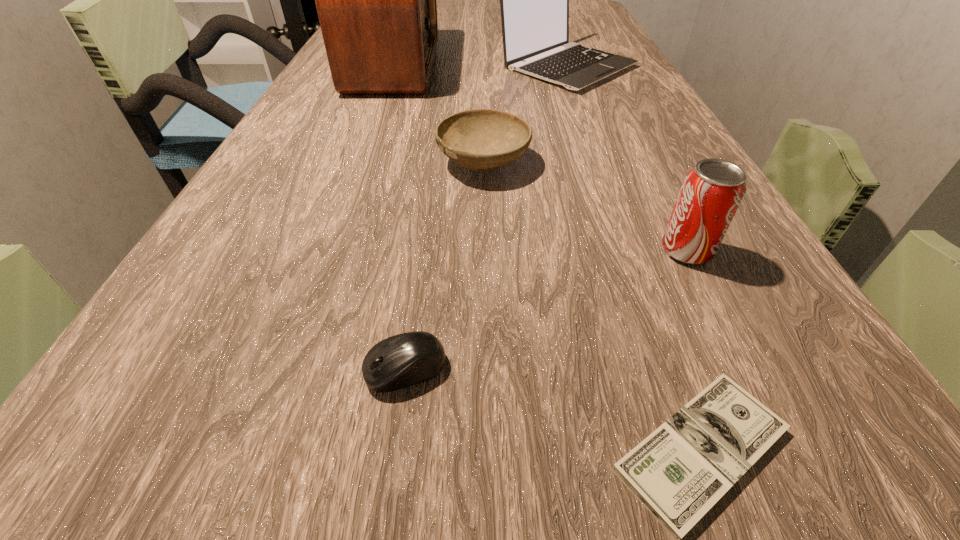
Find the location of a particular element. The image size is (960, 540). radio receiver is located at coordinates (376, 2).

Identify the location of laptop_computer. Image resolution: width=960 pixels, height=540 pixels. (534, 0).

Identify the location of soda can. This screenshot has width=960, height=540. (712, 191).

Identify the location of the third tallest object. (712, 191).

Where is `bowl`? The image size is (960, 540). bowl is located at coordinates (479, 139).

Find the location of a particular element. the fourth nearest object is located at coordinates (479, 139).

The width and height of the screenshot is (960, 540). In order to click on the fifth tallest object in this screenshot , I will do `click(402, 360)`.

Locate an element on the screen. The image size is (960, 540). vacant space situated 0.290m on the front panel of the radio receiver is located at coordinates (553, 65).

At what (x,y) coordinates should I click in order to perform the action: click on vacant space located at the front screen of the laptop_computer. Please return your answer as a coordinate pair (x, y). Looking at the image, I should click on [603, 164].

Identify the location of vacant space located on the front of the soda can. The image size is (960, 540). (709, 297).